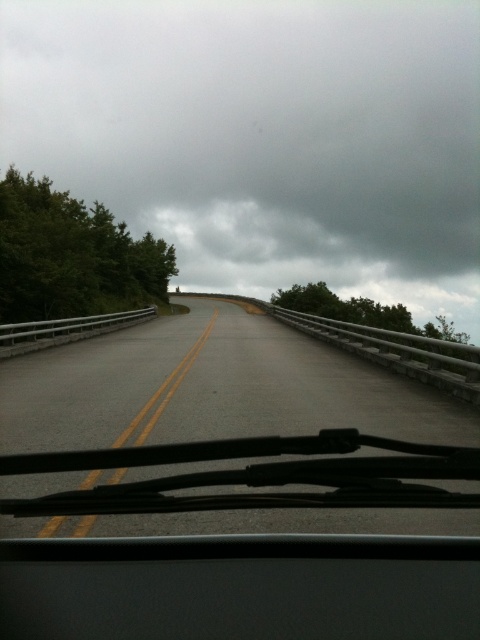
Question: Is asphalt road at center to the right of transparent rubber windshield wipers at bottom from the viewer's perspective?

Choices:
 (A) yes
 (B) no

Answer: (B)

Question: Is asphalt road at center thinner than transparent rubber windshield wipers at bottom?

Choices:
 (A) yes
 (B) no

Answer: (B)

Question: Is asphalt road at center above transparent rubber windshield wipers at bottom?

Choices:
 (A) yes
 (B) no

Answer: (A)

Question: Which object is closer to the camera taking this photo?

Choices:
 (A) transparent rubber windshield wipers at bottom
 (B) asphalt road at center

Answer: (B)